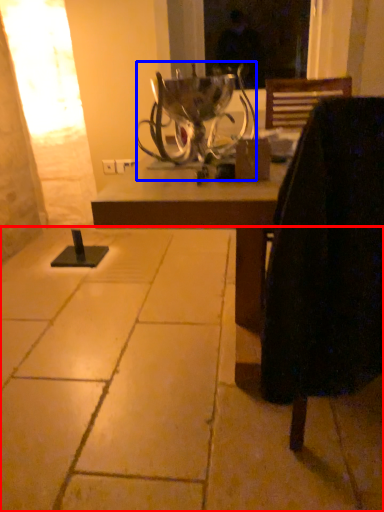
Question: Among these objects, which one is farthest to the camera, concrete (highlighted by a red box) or candle holder (highlighted by a blue box)?

Choices:
 (A) concrete
 (B) candle holder

Answer: (B)